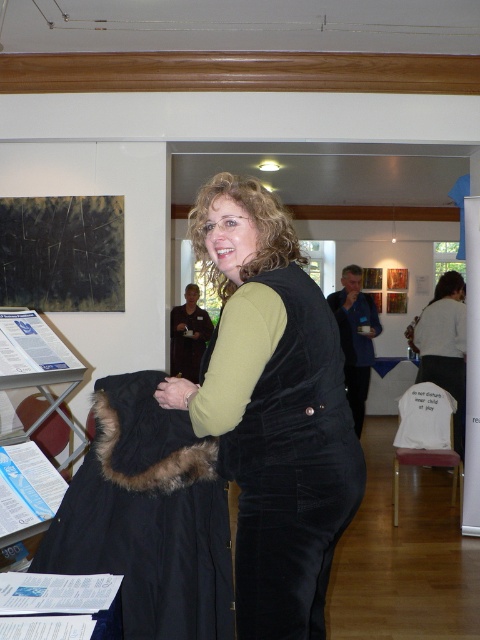
Does velvet black vest at center have a smaller size compared to black furry coat at lower left?

No, velvet black vest at center is not smaller than black furry coat at lower left.

Between point (245, 538) and point (100, 548), which one is positioned in front?

Point (245, 538) is in front.

Locate an element on the screen. The height and width of the screenshot is (640, 480). velvet black vest at center is located at coordinates (273, 410).

Which is behind, point (38, 259) or point (459, 360)?

Positioned behind is point (459, 360).

Can you confirm if dark textured canvas at upper left is positioned below white cotton shirt at center?

Actually, dark textured canvas at upper left is above white cotton shirt at center.

Find the location of a particular element. Image resolution: width=480 pixels, height=640 pixels. dark textured canvas at upper left is located at coordinates (61, 252).

Image resolution: width=480 pixels, height=640 pixels. What are the coordinates of `dark textured canvas at upper left` in the screenshot? It's located at point(61,252).

What do you see at coordinates (273, 410) in the screenshot? The height and width of the screenshot is (640, 480). I see `velvet black vest at center` at bounding box center [273, 410].

Who is more distant from viewer, (273, 483) or (208, 333)?

Point (208, 333)

Identify the location of velvet black vest at center. coord(273,410).